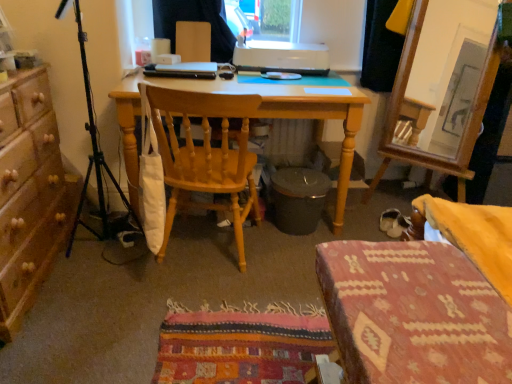
I want to click on free point behind white suede shoe at lower right, so click(x=377, y=205).